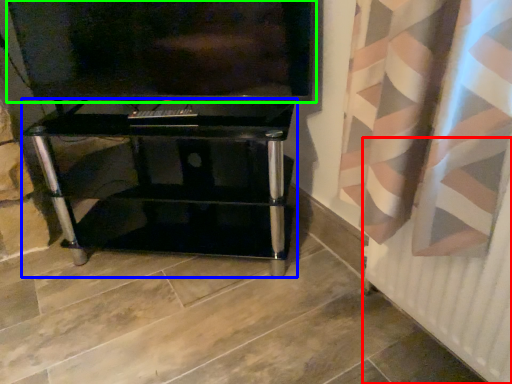
Question: Considering the real-world distances, which object is closest to radiator (highlighted by a red box)? furniture (highlighted by a blue box) or television (highlighted by a green box).

Choices:
 (A) furniture
 (B) television

Answer: (A)